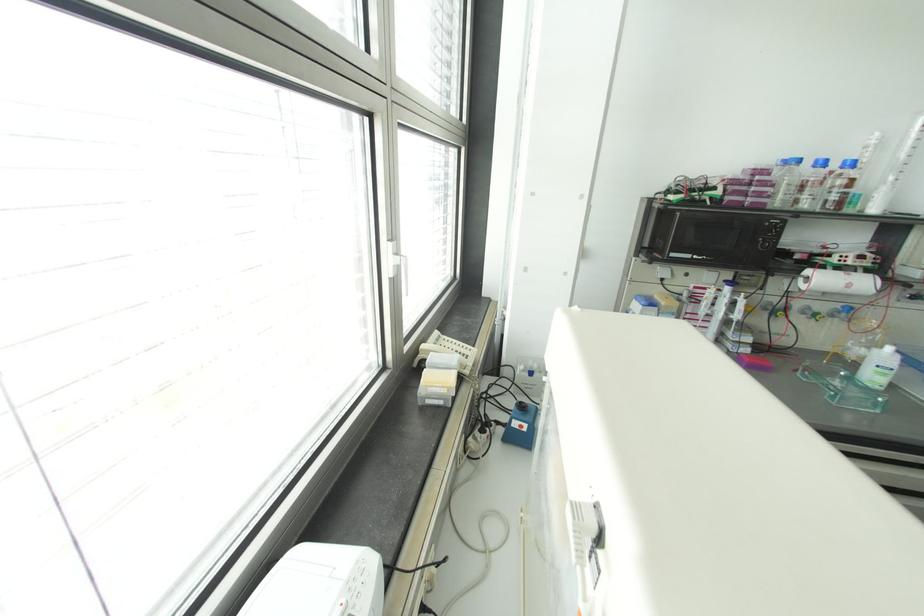
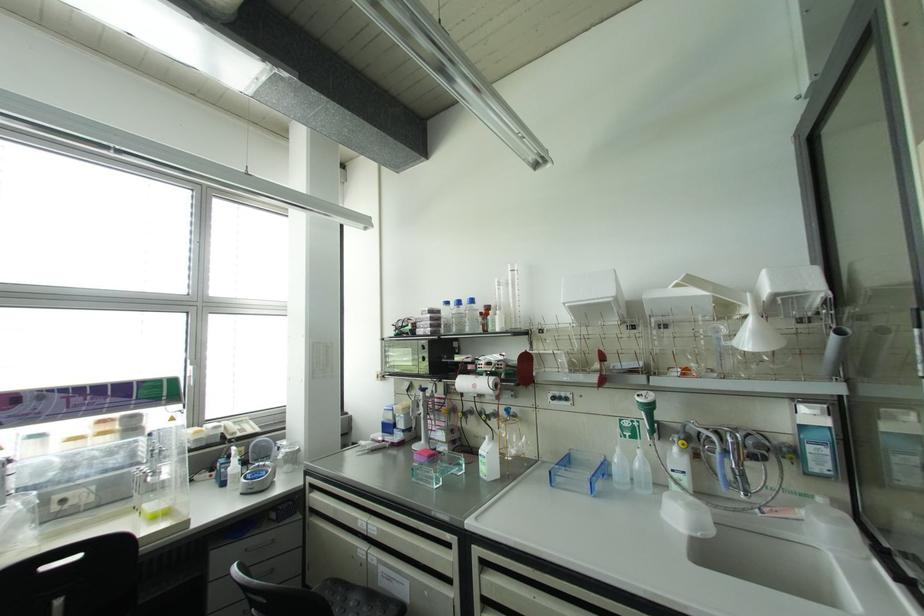
In the second image, find the point that corresponds to pixel 852 163 in the first image.

(471, 301)